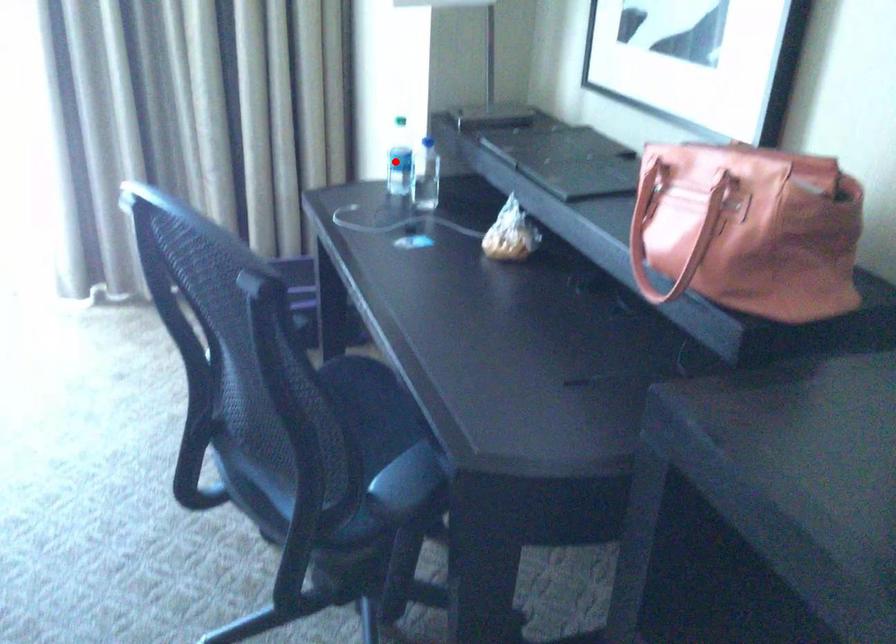
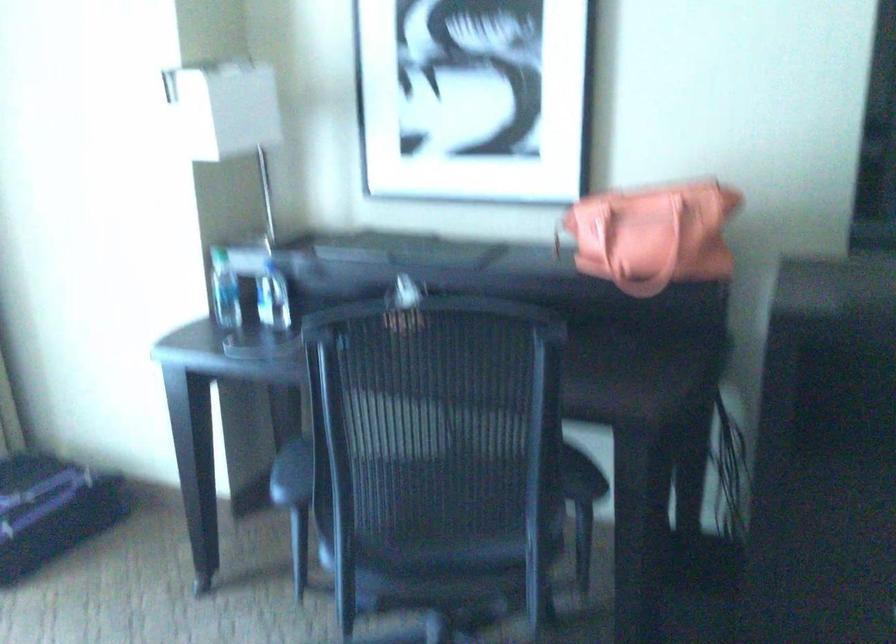
Question: I am providing you with two images of the same scene from different viewpoints. A red point is marked on the first image. Can you still see the location of the red point in image 2?

Choices:
 (A) Yes
 (B) No

Answer: (A)